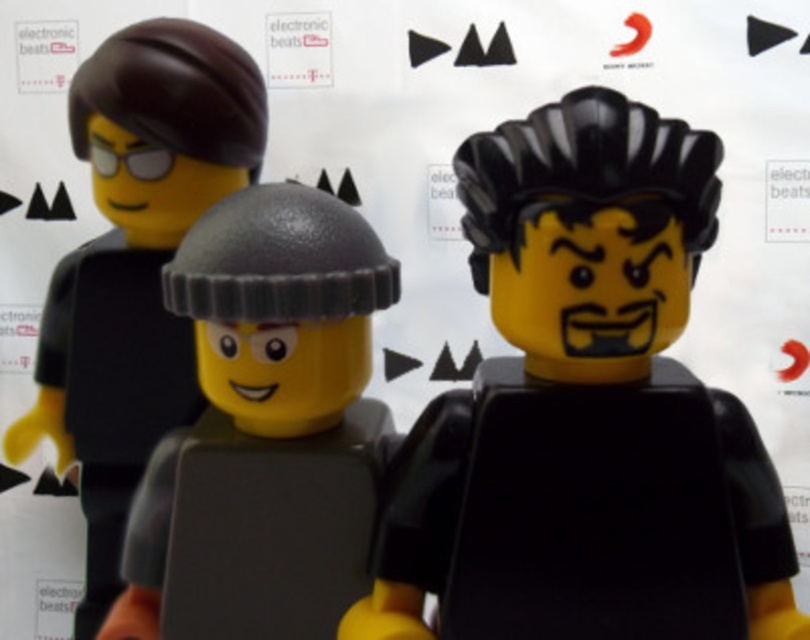
You are a LEGO designer trying to fit both the matte black helmet at center and the matte gray helmet at center onto a display stand that can only accommodate the wider of the two. Which helmet should you choose?

The matte black helmet at center is wider than the matte gray helmet at center, so you should choose the matte black helmet at center for the display stand.

You are standing in front of the image and want to touch the point at coordinates [141,464]. Is this point closer to you than 40 inches?

The point at coordinates [141,464] is 37.18 inches from the camera, so yes, it is closer than 40 inches.

You are a photographer standing 30 inches away from the LEGO minifigures. You want to take a closeup photo of the matte black helmet at center. Is the current distance sufficient to capture the helmet in focus without moving closer?

The matte black helmet at center is 24.31 inches away from the camera. Since you are standing 30 inches away, you are 5.69 inches farther than the required distance. To capture the helmet in focus, you need to move 5.69 inches closer to the matte black helmet at center.